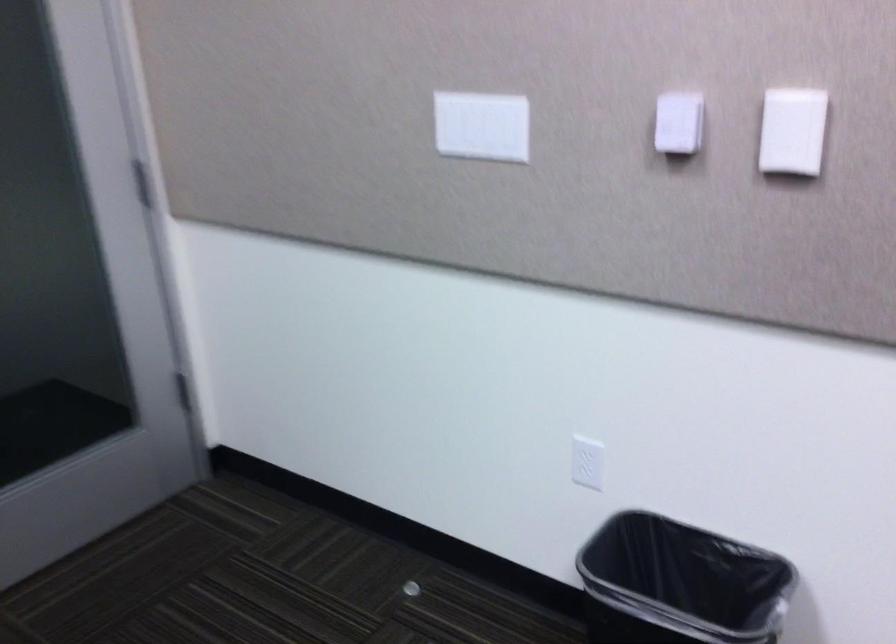
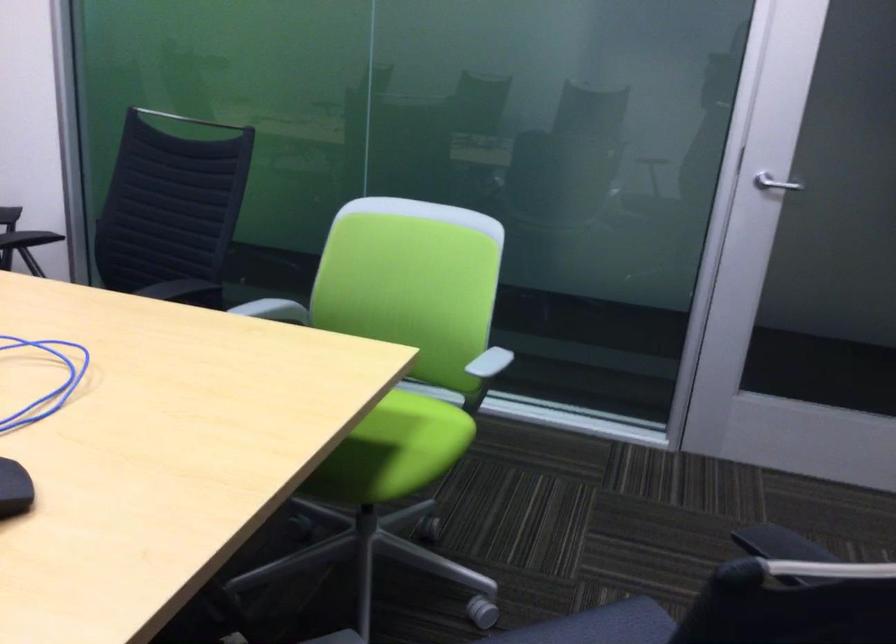
Question: The images are taken continuously from a first-person perspective. In which direction is your viewpoint rotating?

Choices:
 (A) Left
 (B) Right
 (C) Up
 (D) Down

Answer: (A)